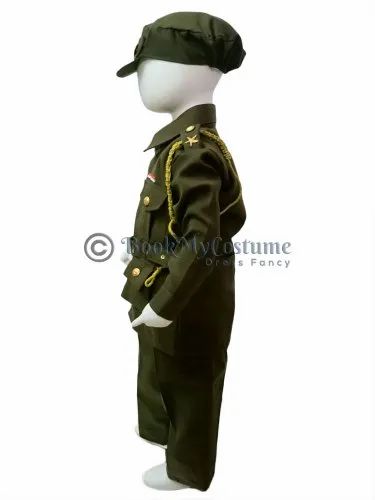
This screenshot has height=500, width=375. I want to click on mannequin's neck, so click(209, 98).